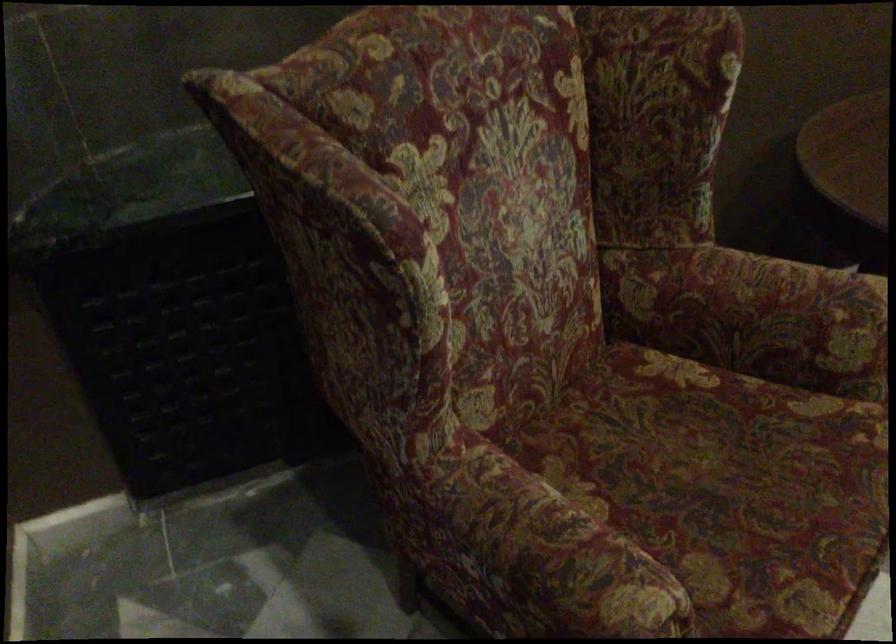
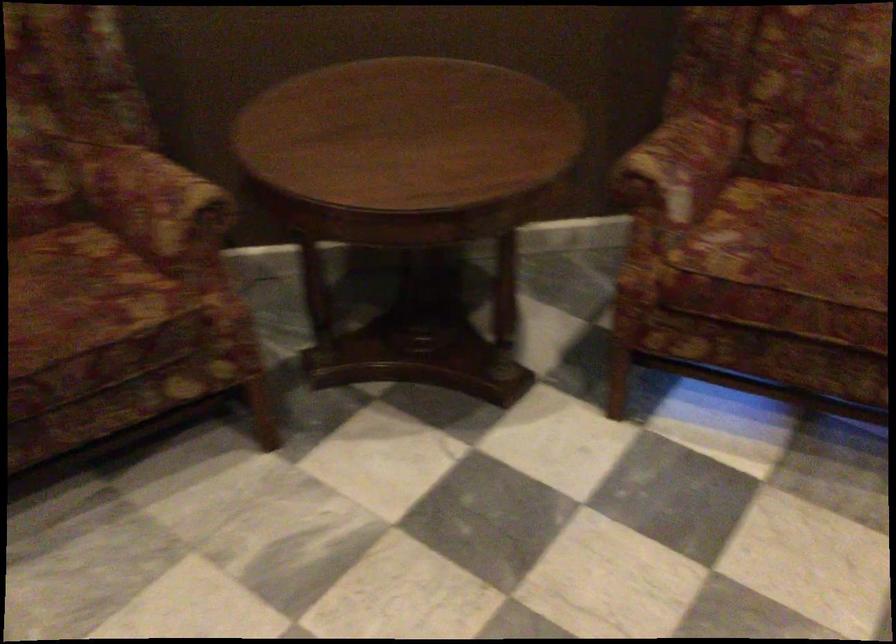
Where in the second image is the point corresponding to (806,310) from the first image?

(156, 204)